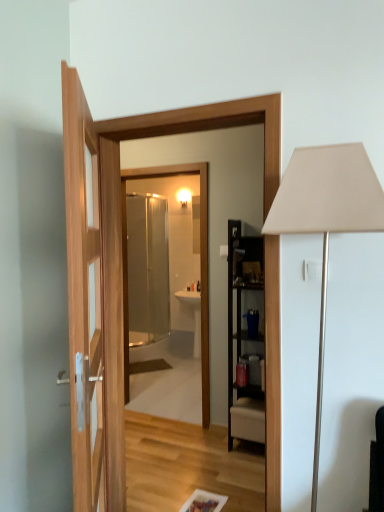
Find the location of `free location above transparent glass mirror at center (from a real-world perspective)`. free location above transparent glass mirror at center (from a real-world perspective) is located at coordinates [x=155, y=169].